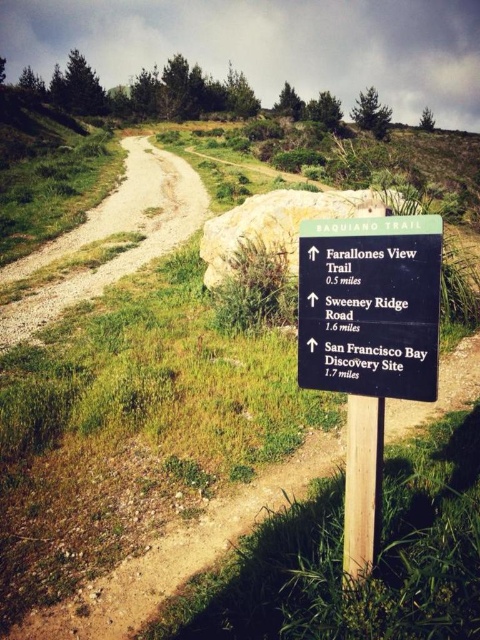
You are a hiker standing at the trailhead and see the black plastic sign at center. If your backpack has a 2 meter long rope, can you tie it to the sign to mark your starting point?

The black plastic sign at center is 2.16 meters away from camera. Since the rope is 2 meters long, it is shorter than the distance to the sign, so you cannot reach it to tie the rope.

You are a hiker who wants to follow the BAQUIANO TRAIL. You see the black plastic sign at center and the gravelly dirt trail at left. Which object is closer to you?

The black plastic sign at center is closer to the viewer than the gravelly dirt trail at left.